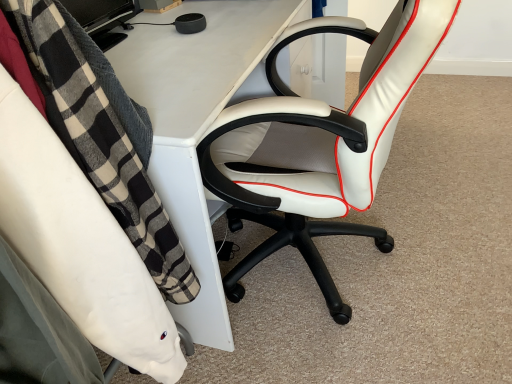
Question: From the image's perspective, is white plastic desk at center beneath white leather office chair at center, which is the 1th chair in right-to-left order?

Choices:
 (A) no
 (B) yes

Answer: (A)

Question: Is the depth of white plastic desk at center greater than that of white leather office chair at center, which is the second chair in left-to-right order?

Choices:
 (A) no
 (B) yes

Answer: (B)

Question: Can you confirm if white plastic desk at center is smaller than white leather office chair at center, which is the second chair in left-to-right order?

Choices:
 (A) no
 (B) yes

Answer: (A)

Question: Is white plastic desk at center looking in the opposite direction of white leather office chair at center, which is the second chair in left-to-right order?

Choices:
 (A) no
 (B) yes

Answer: (B)

Question: Is white plastic desk at center placed right next to white leather office chair at center, which is the 1th chair in right-to-left order?

Choices:
 (A) yes
 (B) no

Answer: (B)

Question: Is white plastic desk at center spatially inside white leather office chair at right, the first chair positioned from the left, or outside of it?

Choices:
 (A) inside
 (B) outside

Answer: (B)

Question: Visually, is white plastic desk at center positioned to the left or to the right of white leather office chair at right, the first chair positioned from the left?

Choices:
 (A) right
 (B) left

Answer: (A)

Question: Is white plastic desk at center taller or shorter than white leather office chair at right, the first chair positioned from the left?

Choices:
 (A) tall
 (B) short

Answer: (A)

Question: In terms of width, does white plastic desk at center look wider or thinner when compared to white leather office chair at right, placed as the second chair when sorted from right to left?

Choices:
 (A) wide
 (B) thin

Answer: (A)

Question: Relative to white leather office chair at center, which is the second chair in left-to-right order, is white plastic desk at center in front or behind?

Choices:
 (A) behind
 (B) front

Answer: (A)

Question: Is point (285, 21) positioned closer to the camera than point (273, 67)?

Choices:
 (A) farther
 (B) closer

Answer: (B)

Question: Is white plastic desk at center bigger or smaller than white leather office chair at center, which is the second chair in left-to-right order?

Choices:
 (A) big
 (B) small

Answer: (A)

Question: From a real-world perspective, is white plastic desk at center above or below white leather office chair at center, which is the second chair in left-to-right order?

Choices:
 (A) above
 (B) below

Answer: (B)

Question: Is white leather office chair at right, placed as the second chair when sorted from right to left, taller or shorter than white leather office chair at center, which is the 1th chair in right-to-left order?

Choices:
 (A) short
 (B) tall

Answer: (A)

Question: From a real-world perspective, is white leather office chair at right, placed as the second chair when sorted from right to left, physically located above or below white leather office chair at center, which is the 1th chair in right-to-left order?

Choices:
 (A) above
 (B) below

Answer: (A)